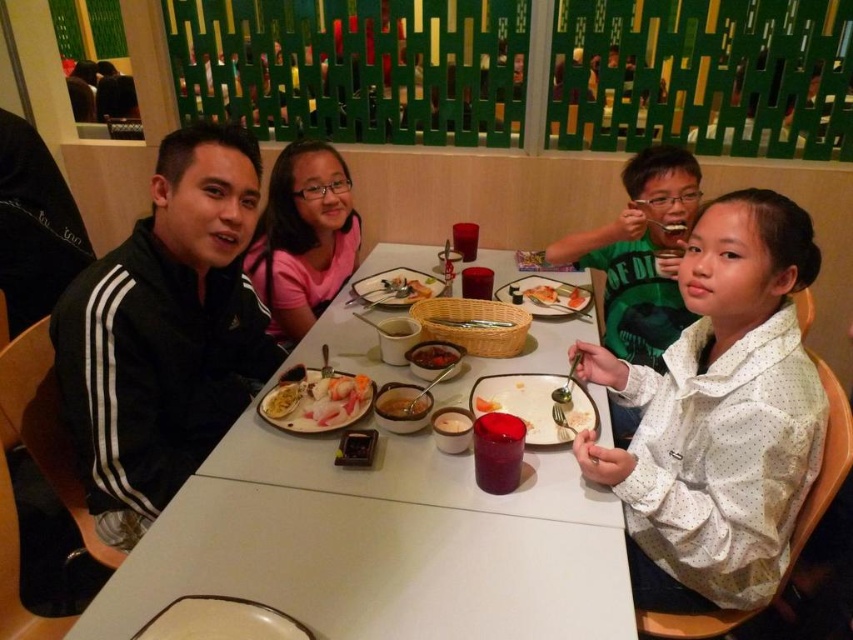
Which is behind, point (814, 262) or point (486, 404)?

The point (486, 404) is more distant.

In the scene shown: Is white dotted shirt at lower right in front of orange matte sushi at center?

Yes, white dotted shirt at lower right is in front of orange matte sushi at center.

Between point (722, 301) and point (491, 400), which one is positioned in front?

Positioned in front is point (722, 301).

This screenshot has height=640, width=853. I want to click on white dotted shirt at lower right, so click(x=718, y=416).

Is white dotted shirt at lower right thinner than slightly glossy dark red sauce at center?

Incorrect, white dotted shirt at lower right's width is not less than slightly glossy dark red sauce at center's.

Does white dotted shirt at lower right come behind slightly glossy dark red sauce at center?

No, it is in front of slightly glossy dark red sauce at center.

Which is behind, point (741, 257) or point (438, 355)?

Positioned behind is point (438, 355).

Find the location of a particular element. This screenshot has height=640, width=853. white dotted shirt at lower right is located at coordinates (718, 416).

Who is lower down, smooth brown rice at center or orange matte sushi at center?

Positioned lower is orange matte sushi at center.

Between smooth brown rice at center and orange matte sushi at center, which one appears on the right side from the viewer's perspective?

Positioned to the right is orange matte sushi at center.

Locate an element on the screen. The width and height of the screenshot is (853, 640). smooth brown rice at center is located at coordinates (402, 406).